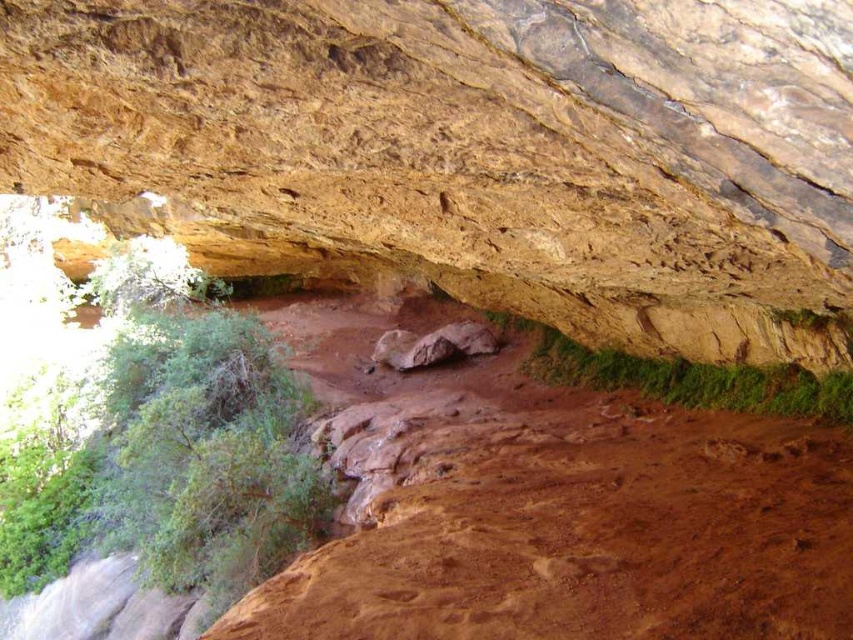
Question: Which point appears closest to the camera in this image?

Choices:
 (A) (434, 349)
 (B) (524, 86)

Answer: (B)

Question: Which of these objects is positioned closest to the brown rough rock at center?

Choices:
 (A) green leafy shrub at left
 (B) rusty rock at center

Answer: (A)

Question: Is brown rough rock at center positioned behind rusty rock at center?

Choices:
 (A) no
 (B) yes

Answer: (A)

Question: Which point is farther to the camera?

Choices:
 (A) (310, 115)
 (B) (210, 305)

Answer: (B)

Question: Does green leafy shrub at left have a smaller size compared to rusty rock at center?

Choices:
 (A) no
 (B) yes

Answer: (A)

Question: From the image, what is the correct spatial relationship of green leafy shrub at left in relation to rusty rock at center?

Choices:
 (A) right
 (B) left

Answer: (B)